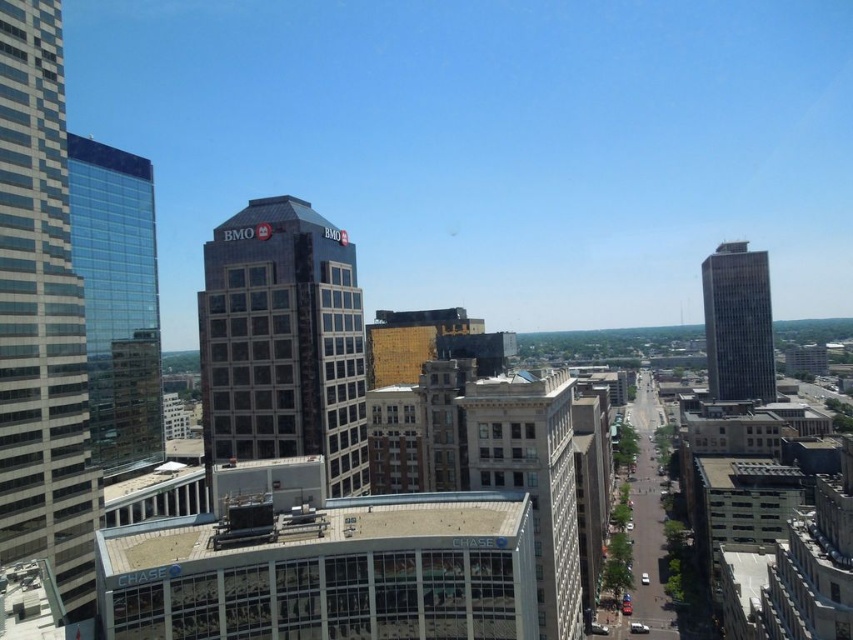
Is point (76, 422) in front of point (480, 477)?

No, it is behind (480, 477).

Does point (53, 572) come closer to viewer compared to point (566, 608)?

Yes.

I want to click on glassy reflective skyscraper at left, so click(41, 317).

In the scene shown: Does glassy reflective skyscraper at left appear on the right side of gray glass skyscraper at right?

In fact, glassy reflective skyscraper at left is to the left of gray glass skyscraper at right.

Is glassy reflective skyscraper at left shorter than gray glass skyscraper at right?

No, glassy reflective skyscraper at left is not shorter than gray glass skyscraper at right.

The width and height of the screenshot is (853, 640). What are the coordinates of `glassy reflective skyscraper at left` in the screenshot? It's located at (41, 317).

You are a GUI agent. You are given a task and a screenshot of the screen. Output one action in this format:
    pyautogui.click(x=<x>, y=<y>)
    Task: Click on the glassy reflective skyscraper at left
    Image resolution: width=853 pixels, height=640 pixels.
    Given the screenshot: What is the action you would take?
    pyautogui.click(x=41, y=317)

Which is more to the left, glassy reflective skyscraper at left or transparent glass skyscraper at left?

transparent glass skyscraper at left

Can you confirm if glassy reflective skyscraper at left is positioned below transparent glass skyscraper at left?

No.

Does point (16, 557) come farther from viewer compared to point (132, 192)?

No, (16, 557) is closer to viewer.

Locate an element on the screen. The height and width of the screenshot is (640, 853). glassy reflective skyscraper at left is located at coordinates (41, 317).